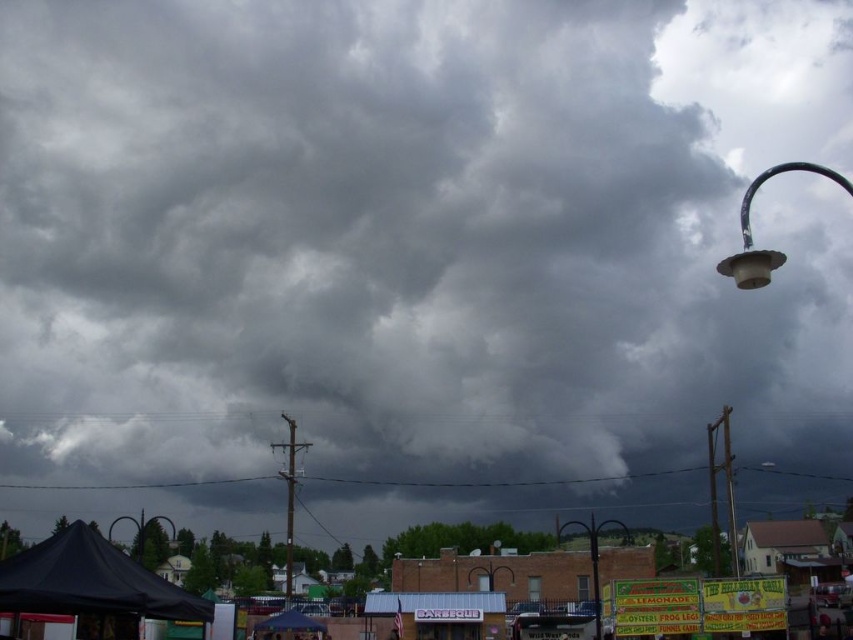
Looking at this image, you are a city planner assessing the spacing between the metallic pole at right and the matte black street light at lower left for safety regulations. The minimum required distance is 300 feet. Is the current distance compliant with the regulations?

The distance between the metallic pole at right and the matte black street light at lower left is 316.01 feet, which exceeds the minimum required 300 feet, so it is compliant with the regulations.

Looking at this image, you are standing at the center of the image and want to locate the matte plastic street light at upper right. According to the coordinates provided, in which direction should you turn your head to look at it?

The matte plastic street light at upper right is located at coordinates point (x=750, y=230). Since you are at the center, you should turn your head to the upper right direction to look at it.

You are standing in front of the streetlamp on the right side of the frame. There are two points marked in the image, one at coordinates point [751,237] and the other at point [735,518]. Which point is closer to you?

Point [751,237] is closer to the viewer than point [735,518].